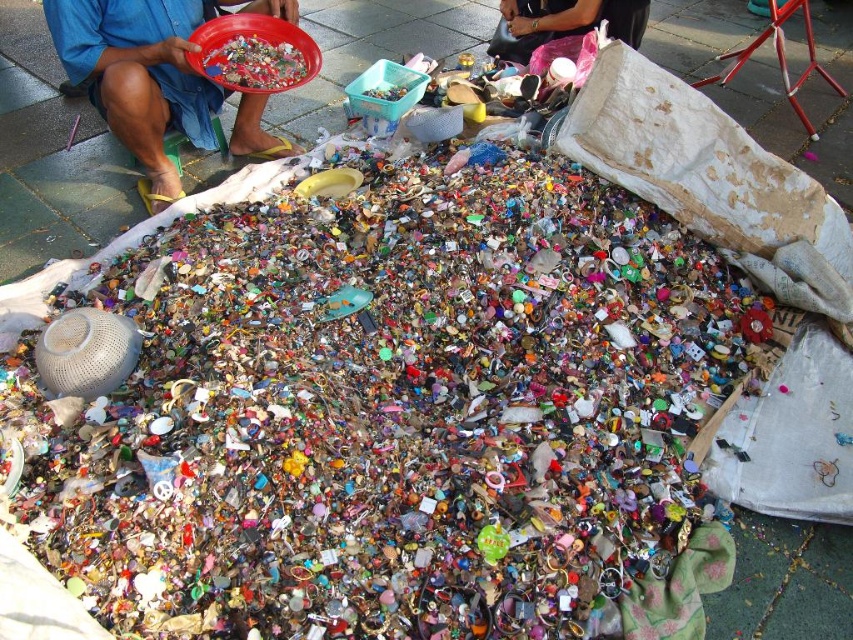
Based on the photo, who is positioned more to the left, blue denim shorts at upper left or matte black bag at upper center?

blue denim shorts at upper left

I want to click on blue denim shorts at upper left, so click(x=146, y=74).

Locate an element on the screen. The image size is (853, 640). blue denim shorts at upper left is located at coordinates (146, 74).